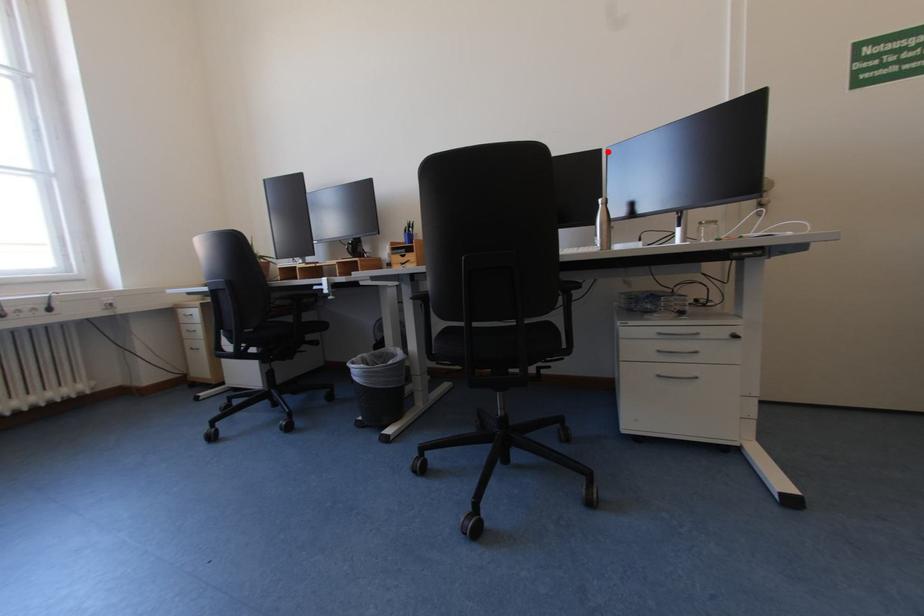
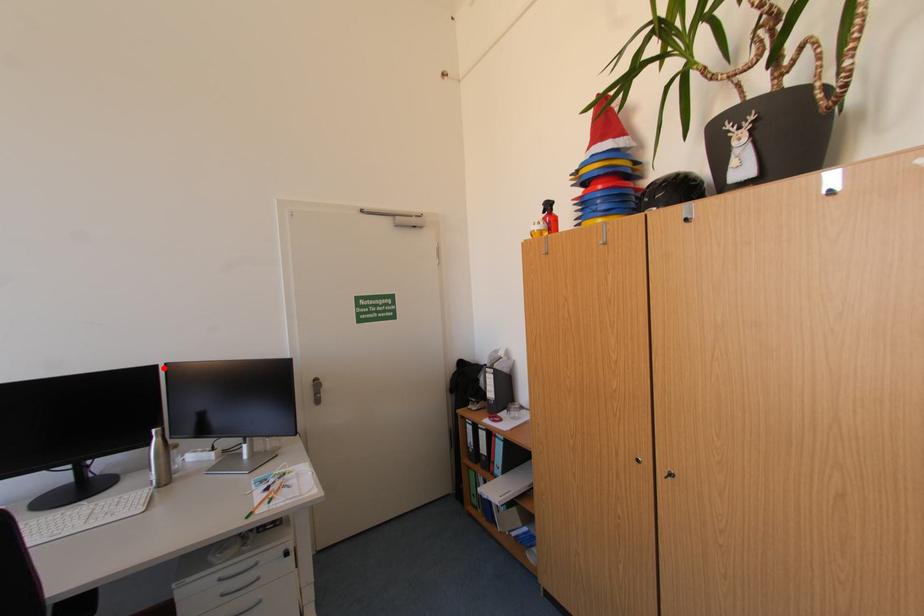
I am providing you with two images of the same scene from different viewpoints. A red point is marked on the first image and another point is marked on the second image. Is the red point in image1 aligned with the point shown in image2?

Yes